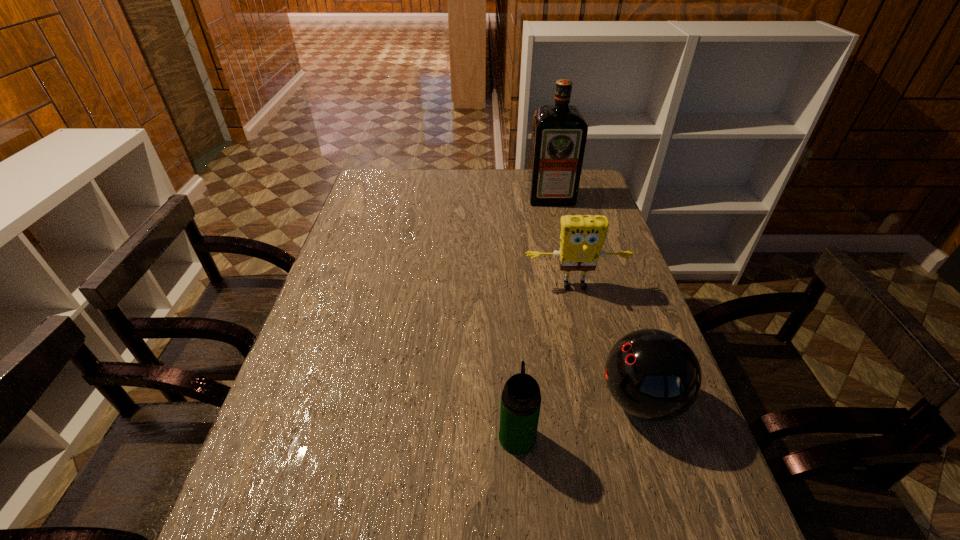
In the image, there is a desktop. At what (x,y) coordinates should I click in order to perform the action: click on free space at the right edge. Please return your answer as a coordinate pair (x, y). The height and width of the screenshot is (540, 960). Looking at the image, I should click on (689, 434).

I want to click on vacant space at the far left corner, so click(396, 172).

Where is `free space that is in between the thermos bottle and the tallest object`? free space that is in between the thermos bottle and the tallest object is located at coordinates (534, 317).

Locate an element on the screen. This screenshot has width=960, height=540. free space between the tallest object and the thermos bottle is located at coordinates pyautogui.click(x=534, y=317).

Find the location of a particular element. This screenshot has height=540, width=960. vacant area that lies between the third nearest object and the bowling ball is located at coordinates (608, 343).

You are a GUI agent. You are given a task and a screenshot of the screen. Output one action in this format:
    pyautogui.click(x=<x>, y=<y>)
    Task: Click on the vacant area that lies between the tallest object and the thermos bottle
    The image size is (960, 540).
    Given the screenshot: What is the action you would take?
    pyautogui.click(x=534, y=317)

The width and height of the screenshot is (960, 540). In order to click on vacant region between the farthest object and the thermos bottle in this screenshot , I will do `click(534, 317)`.

Locate an element on the screen. This screenshot has width=960, height=540. vacant point located between the bowling ball and the thermos bottle is located at coordinates (579, 418).

Locate an element on the screen. Image resolution: width=960 pixels, height=540 pixels. vacant area that lies between the leftmost object and the bowling ball is located at coordinates (579, 418).

The height and width of the screenshot is (540, 960). Identify the location of unoccupied position between the leftmost object and the bowling ball. (579, 418).